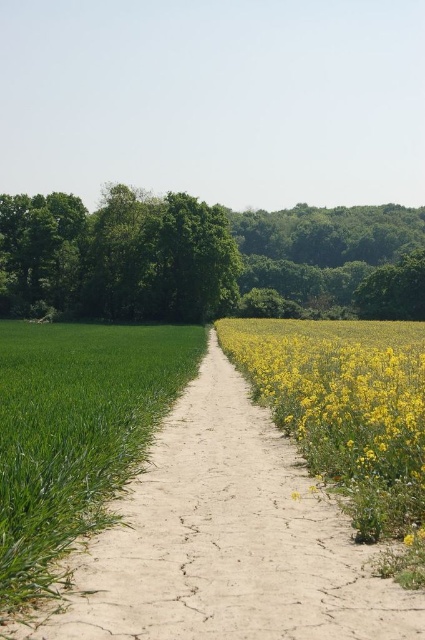
Question: Does dusty brown dirt track at center have a larger size compared to yellow matte flowers at center-right?

Choices:
 (A) yes
 (B) no

Answer: (B)

Question: In this image, where is dusty brown dirt track at center located relative to green leafy tree at upper center?

Choices:
 (A) above
 (B) below

Answer: (B)

Question: Considering the real-world distances, which object is closest to the green grass at left?

Choices:
 (A) yellow matte flowers at center-right
 (B) green leafy tree at upper center

Answer: (A)

Question: Which point is closer to the camera taking this photo?

Choices:
 (A) (405, 353)
 (B) (59, 451)
 (C) (319, 536)

Answer: (C)

Question: Is green leafy tree at upper center thinner than green grass at left?

Choices:
 (A) yes
 (B) no

Answer: (B)

Question: Estimate the real-world distances between objects in this image. Which object is farther from the green leafy tree at upper center?

Choices:
 (A) yellow matte flowers at center-right
 (B) dusty brown dirt track at center
 (C) green grass at left

Answer: (B)